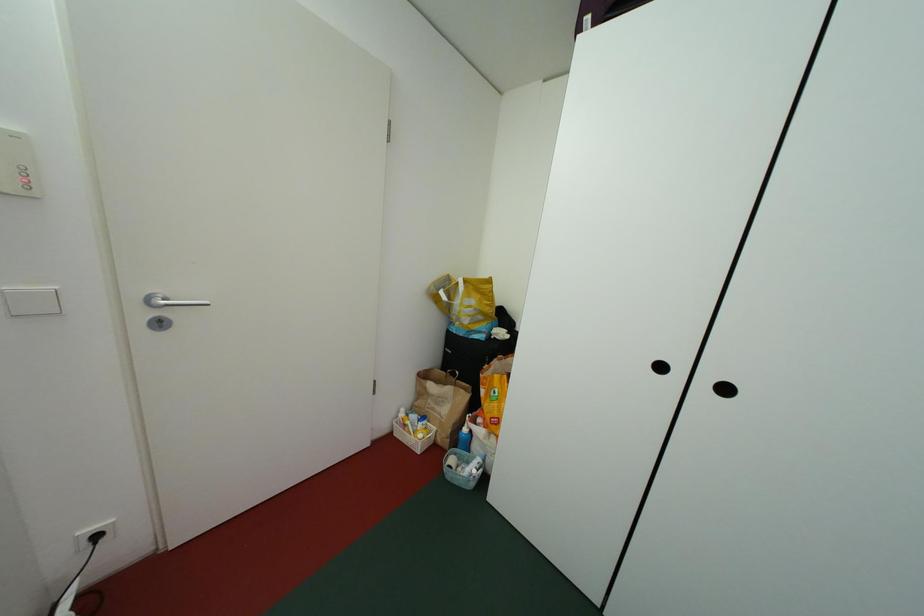
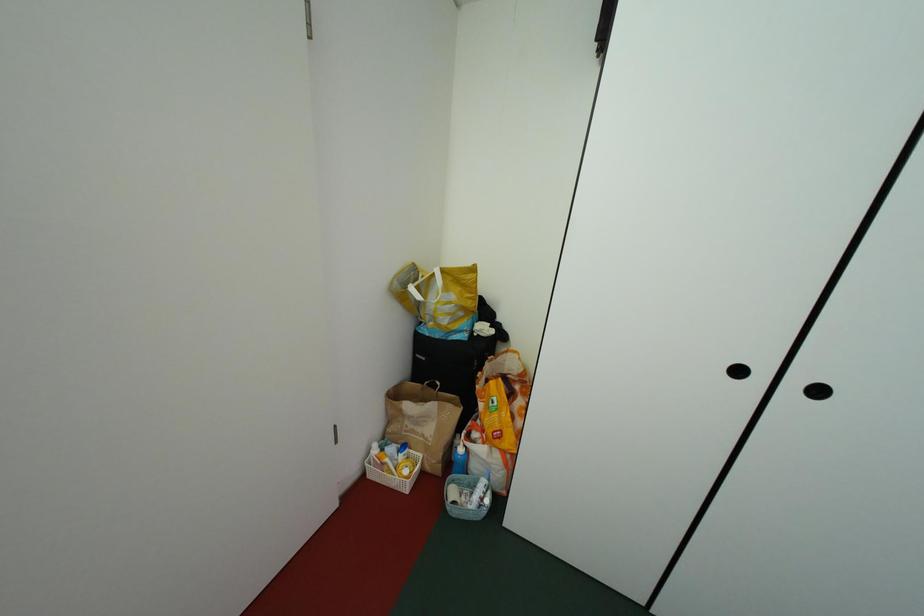
The images are taken continuously from a first-person perspective. In which direction are you moving?

The cameraman walked toward left, forward.